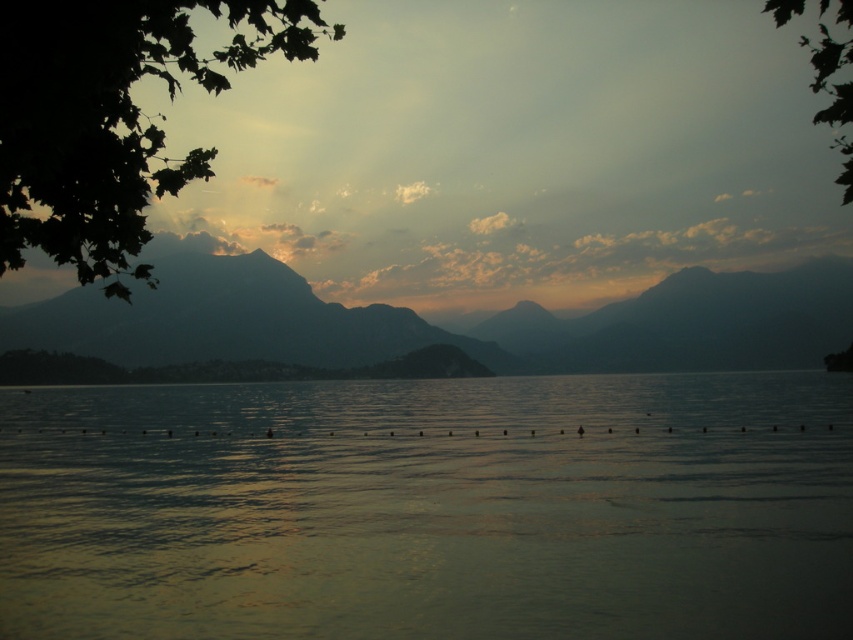
You are an observer looking at the serene lakeside scene. You notice two green leafy trees in the upper part of the image. Which tree is closer to you, the green leafy tree at upper left or the green leafy tree at upper right?

The green leafy tree at upper left is closer to you because it is in front of the green leafy tree at upper right.

You are standing at the lakeside and want to take a photo of both the green leafy tree at upper left and the green leafy tree at upper right. Which tree should you position yourself closer to in order to capture both in the frame?

You should position yourself closer to the green leafy tree at upper left since it is on the left side of the green leafy tree at upper right, allowing both trees to be included in the frame when centered.